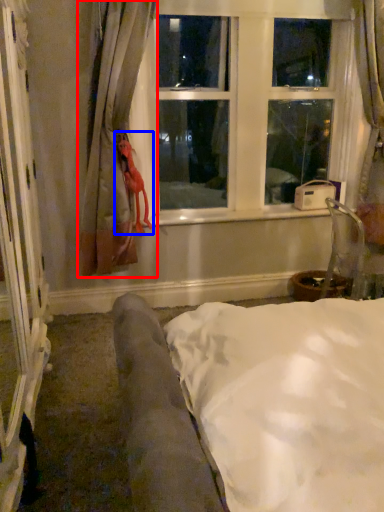
Question: Which point is further to the camera, curtain (highlighted by a red box) or doll (highlighted by a blue box)?

Choices:
 (A) curtain
 (B) doll

Answer: (B)